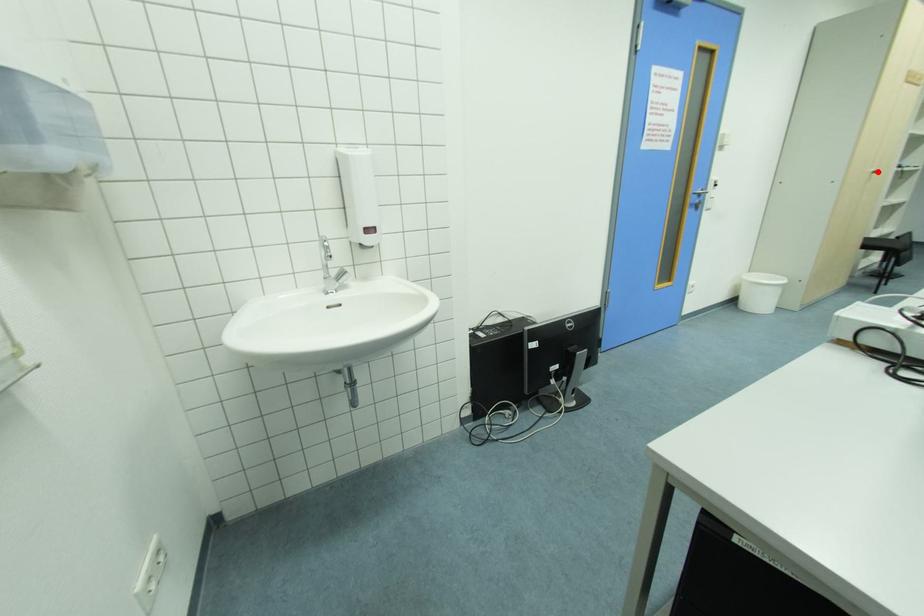
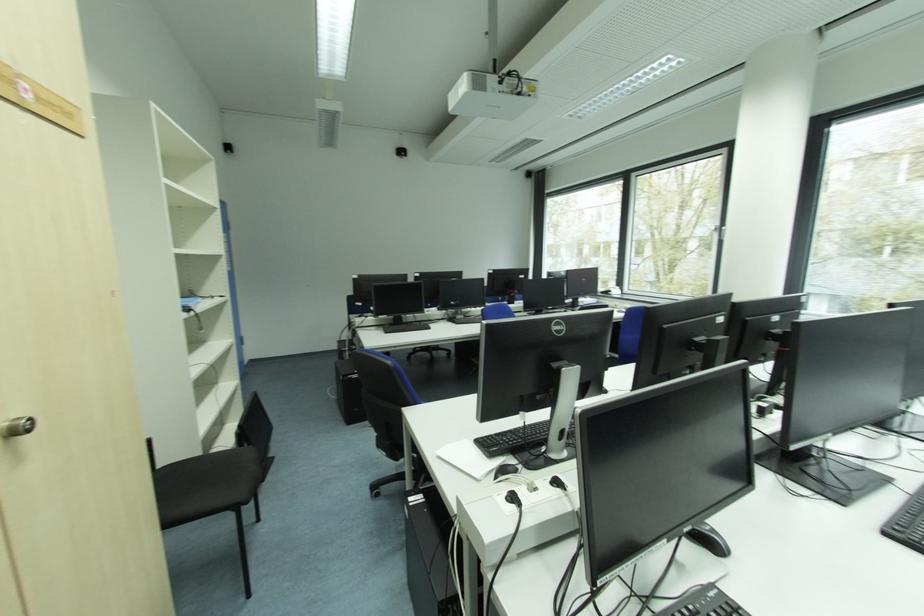
Question: A red point is marked in image1. In image2, is the corresponding 3D point closer to the camera or farther? Reply with the corresponding letter.

Choices:
 (A) The corresponding 3D point is closer.
 (B) The corresponding 3D point is farther.

Answer: (A)